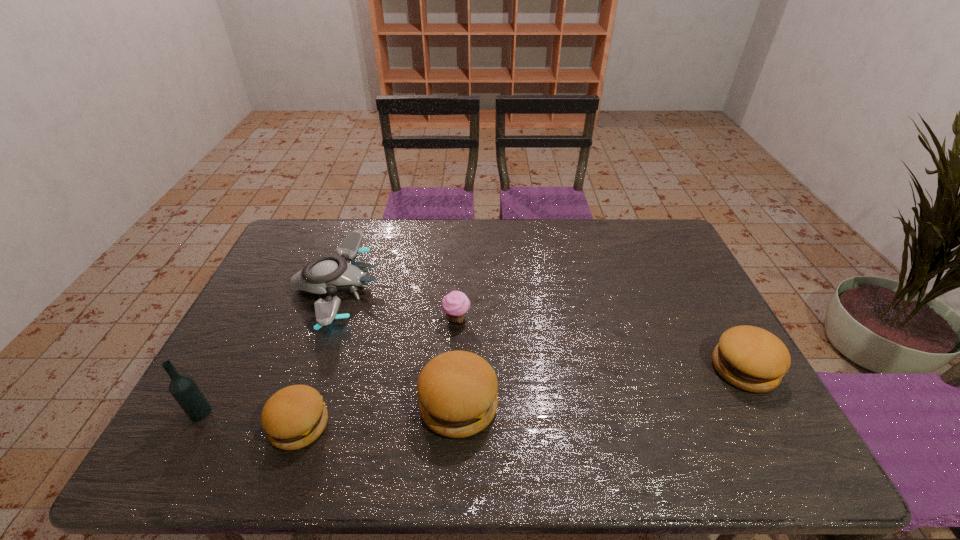
If we want them evenly spaced by inserting an extra hamburger among them, please locate a free spot for this new hamburger. Please provide its 2D coordinates. Your answer should be formatted as a tuple, i.e. [(x, y)], where the tuple contains the x and y coordinates of a point satisfying the conditions above.

[(607, 386)]